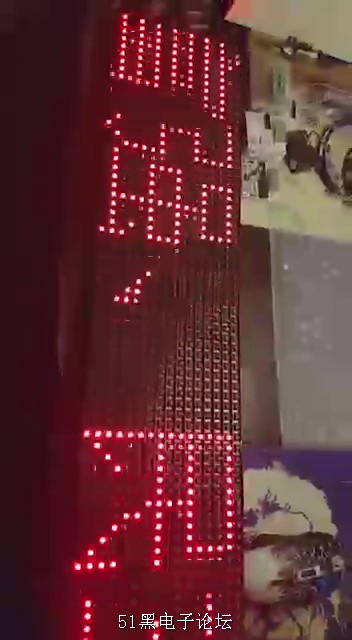
At what (x,y) coordinates should I click in order to perform the action: click on eimpty space above picture. Please return your answer as a coordinate pair (x, y). This screenshot has height=640, width=352. Looking at the image, I should click on (330, 29).